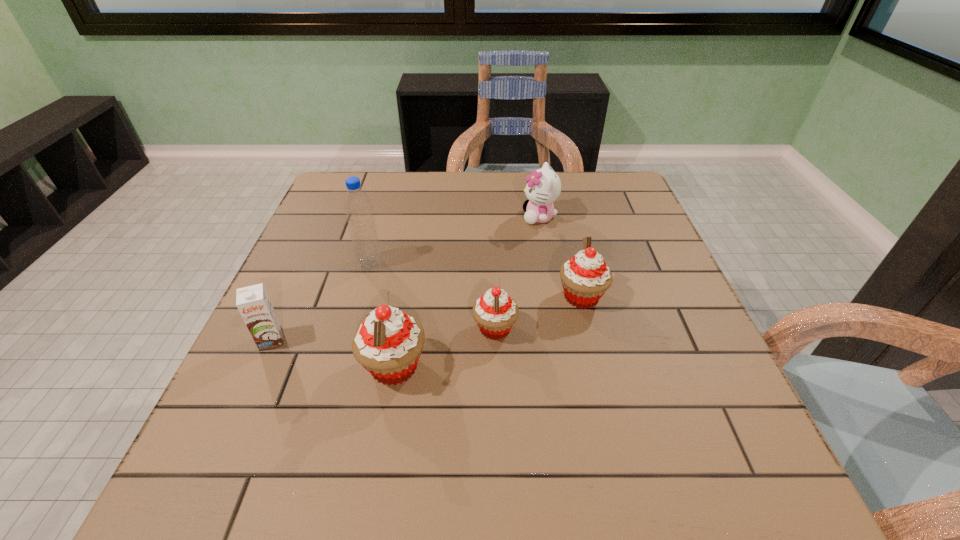
The image size is (960, 540). I want to click on blank region between the fourth object from right to left and the shortest cupcake, so coord(444,348).

The image size is (960, 540). In order to click on empty space between the third object from right to left and the tallest object in this screenshot , I will do `click(432, 296)`.

Locate an element on the screen. The height and width of the screenshot is (540, 960). unoccupied position between the rightmost cupcake and the leftmost object is located at coordinates (426, 318).

I want to click on vacant space that is in between the leftmost cupcake and the leftmost object, so click(332, 353).

The image size is (960, 540). I want to click on object that ranks as the fourth closest to the tallest object, so click(543, 187).

Identify which object is the second closest to the fifth object from right to left. Please provide its 2D coordinates. Your answer should be formatted as a tuple, i.e. [(x, y)], where the tuple contains the x and y coordinates of a point satisfying the conditions above.

[(388, 344)]

Select which cupcake appears as the second closest to the fourth object from right to left. Please provide its 2D coordinates. Your answer should be formatted as a tuple, i.e. [(x, y)], where the tuple contains the x and y coordinates of a point satisfying the conditions above.

[(585, 277)]

I want to click on cupcake that can be found as the closest to the chocolate milk, so click(x=388, y=344).

Identify the location of vacant region that satisfies the following two spatial constraints: 1. on the back side of the second tallest cupcake; 2. on the right side of the third object from right to left. This screenshot has height=540, width=960. click(x=494, y=296).

Find the location of a particular element. This screenshot has width=960, height=540. vacant space that satisfies the following two spatial constraints: 1. on the front-facing side of the kitten; 2. on the right side of the second tallest cupcake is located at coordinates (553, 296).